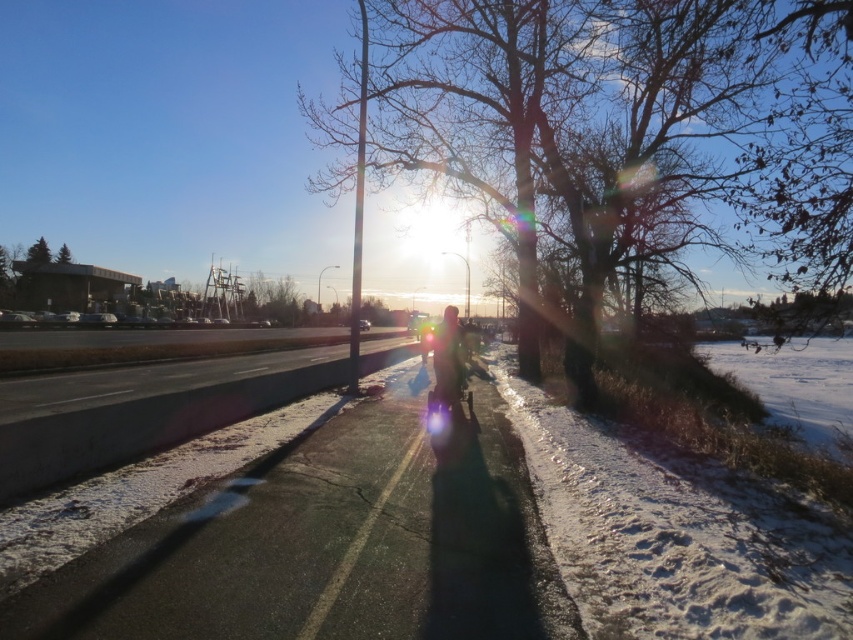
Question: Which object is the closest to the smooth asphalt road at center?

Choices:
 (A) matte black jacket at center
 (B) green textured pine tree at upper left

Answer: (A)

Question: Does bare branches at center appear on the right side of smooth asphalt road at center?

Choices:
 (A) no
 (B) yes

Answer: (A)

Question: Which is farther from the bare branches at center?

Choices:
 (A) green textured pine tree at upper left
 (B) matte black jacket at center

Answer: (A)

Question: Can you confirm if bare branches at center is thinner than smooth asphalt road at center?

Choices:
 (A) no
 (B) yes

Answer: (A)

Question: Observing the image, what is the correct spatial positioning of bare branches at center in reference to smooth asphalt road at center?

Choices:
 (A) below
 (B) above

Answer: (B)

Question: Which is nearer to the green textured pine tree at upper left?

Choices:
 (A) bare branches at center
 (B) smooth asphalt road at center
 (C) matte black jacket at center

Answer: (A)